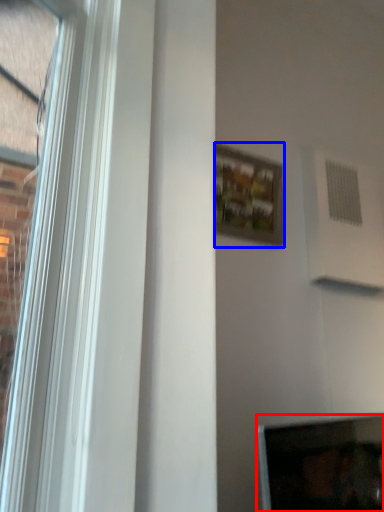
Question: Among these objects, which one is nearest to the camera, computer screen (highlighted by a red box) or picture frame (highlighted by a blue box)?

Choices:
 (A) computer screen
 (B) picture frame

Answer: (A)